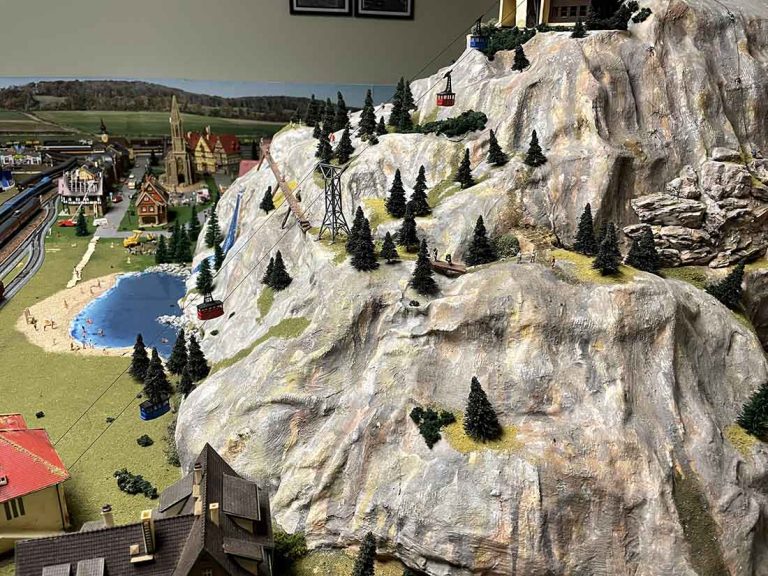
This screenshot has height=576, width=768. Find the location of `chimney`. chimney is located at coordinates (146, 522), (217, 510).